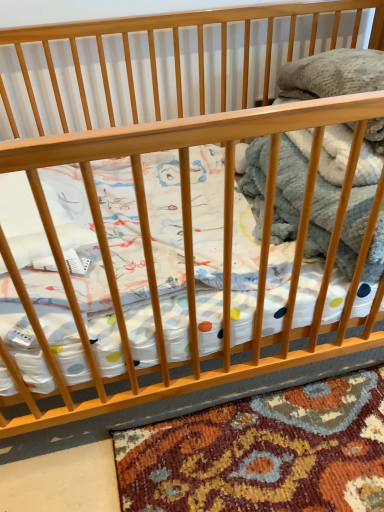
This screenshot has width=384, height=512. In order to click on empty space that is ontop of textured wool rug at lower center (from a real-world perspective) in this screenshot , I will do tap(227, 443).